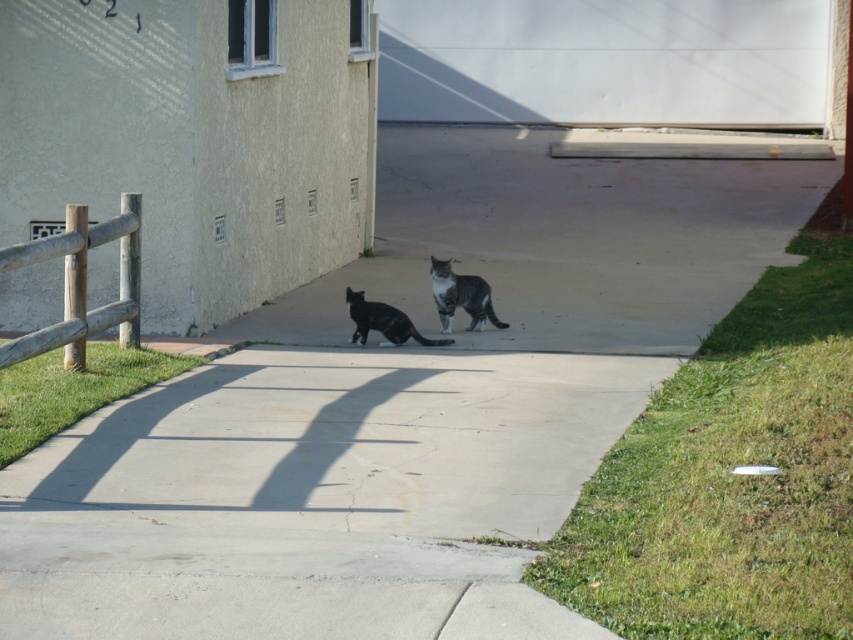
Which of these two, striped fur cat at center or shiny black cat at center, stands shorter?

shiny black cat at center is shorter.

Is striped fur cat at center positioned behind shiny black cat at center?

Yes, it is.

Locate an element on the screen. This screenshot has height=640, width=853. striped fur cat at center is located at coordinates (461, 296).